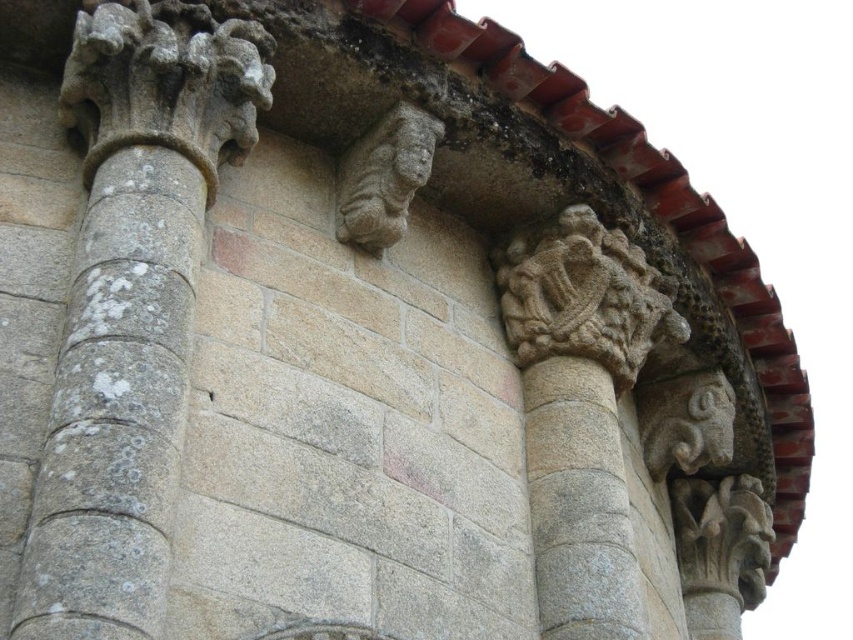
Question: Does gray stone column at center appear on the left side of carved stone lion at center?

Choices:
 (A) yes
 (B) no

Answer: (A)

Question: Which object is positioned closest to the gray stone column at center?

Choices:
 (A) carved stone lion at center
 (B) carved stone sculpture at upper center
 (C) smooth stone face at center

Answer: (A)

Question: Is carved stone sculpture at upper center closer to camera compared to carved stone lion at center?

Choices:
 (A) no
 (B) yes

Answer: (A)

Question: Does carved stone lion at center appear on the right side of smooth stone face at center?

Choices:
 (A) yes
 (B) no

Answer: (B)

Question: Which of the following is the closest to the observer?

Choices:
 (A) (368, 248)
 (B) (64, 476)
 (C) (421, 136)

Answer: (B)

Question: Which object appears closest to the camera in this image?

Choices:
 (A) smooth stone face at center
 (B) gray stone column at center

Answer: (B)